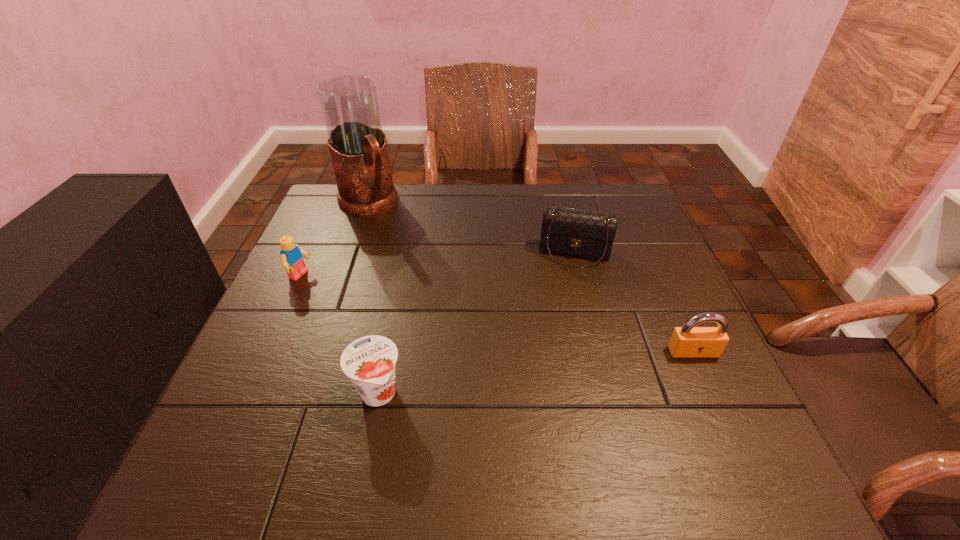
Locate an element on the screen. Image resolution: width=960 pixels, height=540 pixels. vacant space at the far right corner of the desktop is located at coordinates (582, 187).

Identify the location of vacant region at the near right corner. The width and height of the screenshot is (960, 540). (692, 416).

You are a GUI agent. You are given a task and a screenshot of the screen. Output one action in this format:
    pyautogui.click(x=<x>, y=<y>)
    Task: Click on the vacant area between the farthest object and the clutch bag
    The height and width of the screenshot is (540, 960).
    Given the screenshot: What is the action you would take?
    pyautogui.click(x=470, y=228)

Locate an element on the screen. This screenshot has height=540, width=960. free space between the pitcher and the third object from left to right is located at coordinates (372, 298).

This screenshot has width=960, height=540. What are the coordinates of `blank region between the clutch bag and the rightmost object` in the screenshot? It's located at (634, 302).

Identify the location of vacant region between the Lego and the third object from right to left. (339, 335).

Find the location of a particular element. The height and width of the screenshot is (540, 960). vacant space that is in between the farthest object and the Lego is located at coordinates (334, 239).

This screenshot has height=540, width=960. Find the location of `free spot between the farthest object and the second object from right to left`. free spot between the farthest object and the second object from right to left is located at coordinates (470, 228).

Identify the location of free space that is in between the Lego and the yogurt. Image resolution: width=960 pixels, height=540 pixels. (339, 335).

Where is `free space that is in between the second object from right to left and the second nearest object`? free space that is in between the second object from right to left and the second nearest object is located at coordinates (634, 302).